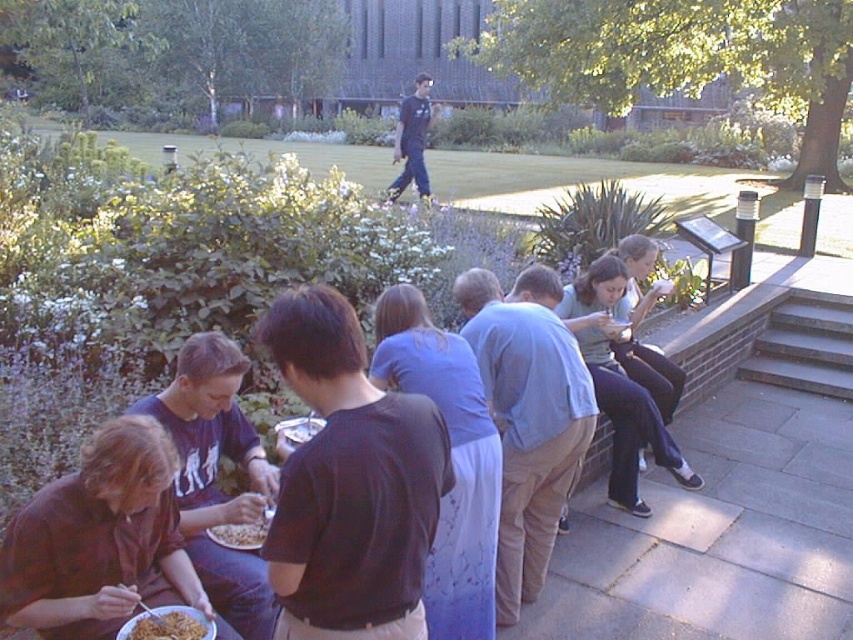
You are a food critic who just arrived at the park and noticed two types of noodles on the communal meal table. The golden crispy noodles at lower left and the smooth white noodles at lower left are both in your view. Which of these noodles is closer to you?

The golden crispy noodles at lower left is shorter than smooth white noodles at lower left, so the golden crispy noodles at lower left is closer to you because shorter objects appear closer when viewed from the same angle.

You are a photographer trying to capture a closeup shot of the golden crispy noodles at lower left. However, you notice the brown fabric shirt at lower left is blocking your view. Based on their positions, can you determine if the shirt is to the left or right of the noodles?

The brown fabric shirt at lower left is positioned on the left side of golden crispy noodles at lower left, so the shirt is blocking the left side of the noodles, meaning the shirt is to the left of the noodles.